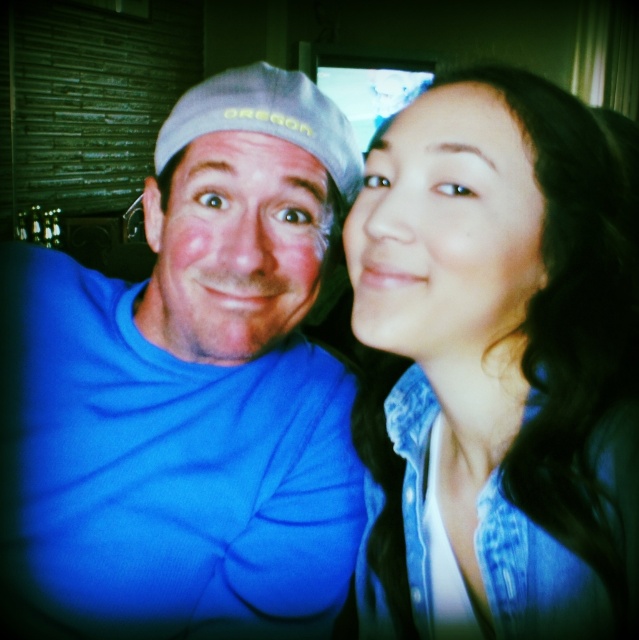
You are using a photo editing software and need to apply a filter to the smooth skin face at center. According to the coordinates provided, where exactly on the image should you place the filter to ensure it covers the face properly?

The smooth skin face at center is located at point coordinates (447, 234), so you should place the filter at those coordinates to cover the face properly.

You are trying to determine the positions of the two people in the image. The blue fabric shirt at center belongs to the person on the left, while the smooth skin face at center belongs to the person on the right. Based on their positions, which object is closer to the left side of the image?

The blue fabric shirt at center is to the left of the smooth skin face at center, so the blue fabric shirt at center is closer to the left side of the image.